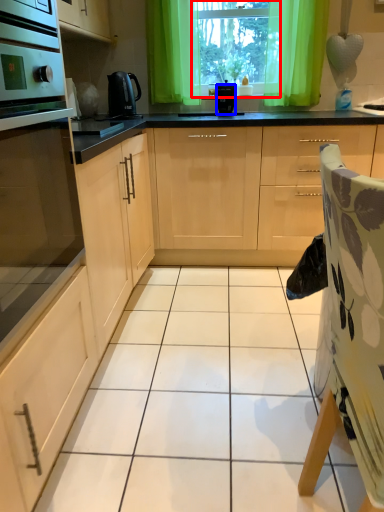
Question: Among these objects, which one is farthest to the camera, window screen (highlighted by a red box) or kitchen appliance (highlighted by a blue box)?

Choices:
 (A) window screen
 (B) kitchen appliance

Answer: (A)